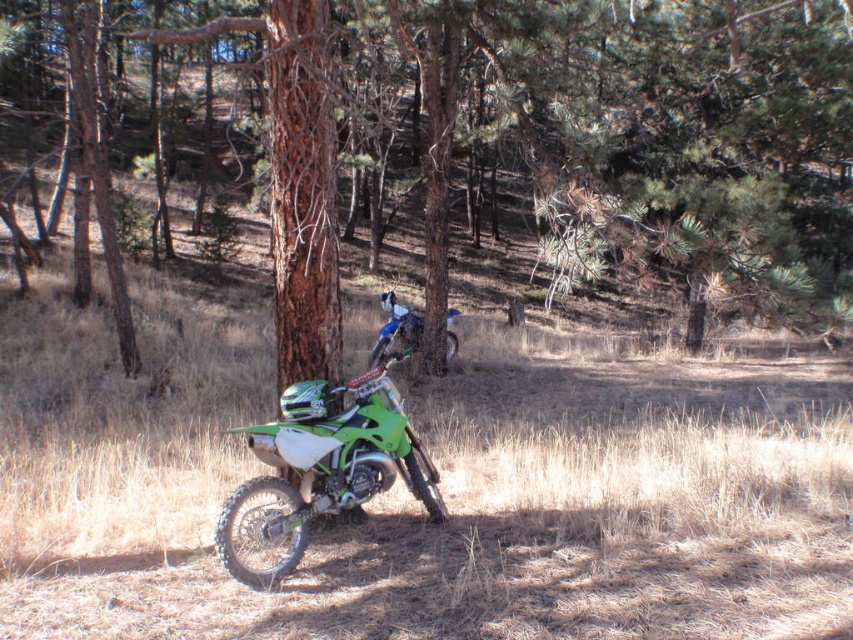
Question: Is green matte motorbike at center behind blue metallic motorcycle at center?

Choices:
 (A) no
 (B) yes

Answer: (A)

Question: Which of the following is the closest to the observer?

Choices:
 (A) blue metallic motorcycle at center
 (B) green matte dirt bike at center
 (C) green matte motorbike at center

Answer: (C)

Question: Does green matte dirt bike at center have a greater width compared to blue metallic motorcycle at center?

Choices:
 (A) yes
 (B) no

Answer: (A)

Question: Does green matte motorbike at center have a larger size compared to blue metallic motorcycle at center?

Choices:
 (A) no
 (B) yes

Answer: (B)

Question: Which point is farther to the camera?

Choices:
 (A) (347, 413)
 (B) (339, 48)

Answer: (B)

Question: Which of the following is the farthest from the observer?

Choices:
 (A) (405, 336)
 (B) (299, 467)

Answer: (A)